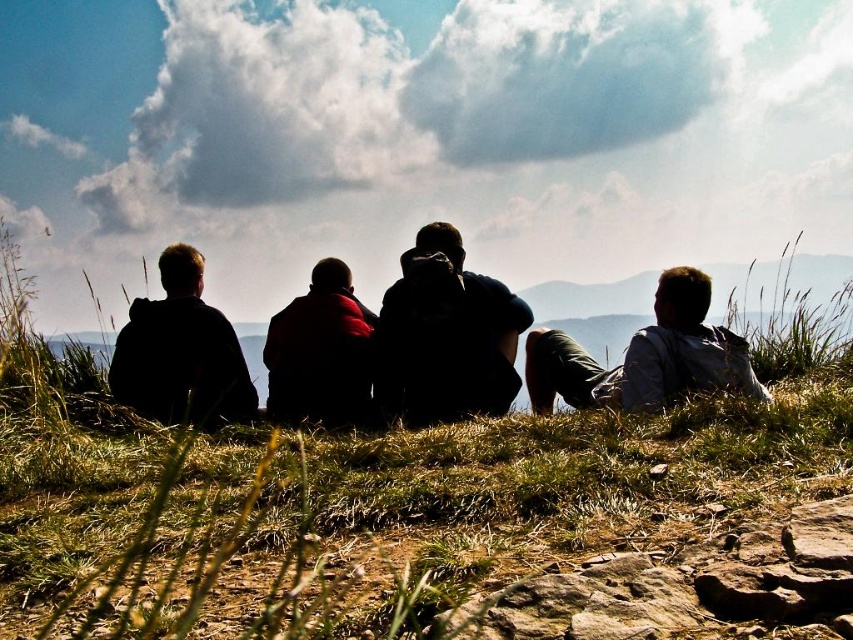
Question: Is silhouette jacket at center to the left of red woolen sweater at center from the viewer's perspective?

Choices:
 (A) no
 (B) yes

Answer: (A)

Question: Which of these objects is positioned closest to the silhouette jacket at center?

Choices:
 (A) black matte jacket at left
 (B) green grassy at center

Answer: (A)

Question: Which object appears closest to the camera in this image?

Choices:
 (A) red woolen sweater at center
 (B) green grassy at center
 (C) black matte jacket at left

Answer: (B)

Question: Observing the image, what is the correct spatial positioning of black matte jacket at left in reference to red woolen sweater at center?

Choices:
 (A) above
 (B) below

Answer: (B)

Question: Can you confirm if light gray fabric shirt at center is wider than black matte jacket at left?

Choices:
 (A) yes
 (B) no

Answer: (A)

Question: Among these objects, which one is farthest from the camera?

Choices:
 (A) black matte jacket at left
 (B) silhouette jacket at center
 (C) green grassy at center

Answer: (A)